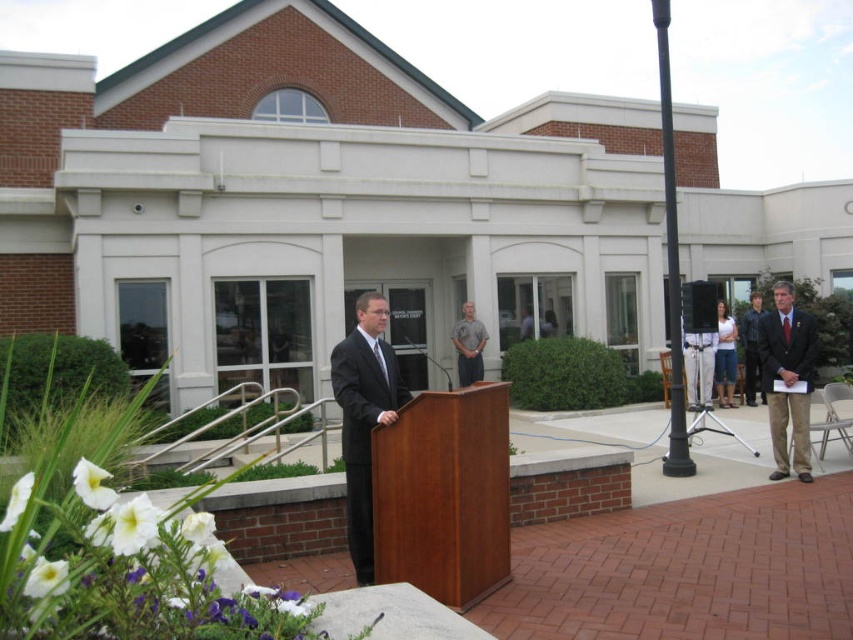
Question: Which of the following is the closest to the observer?

Choices:
 (A) dark blue leather jacket at right
 (B) dark brown suit at right

Answer: (B)

Question: Can you confirm if cherry wood podium at center is smaller than white cotton shirt at center?

Choices:
 (A) yes
 (B) no

Answer: (A)

Question: Which object is positioned closest to the dark blue leather jacket at right?

Choices:
 (A) white cotton shirt at center
 (B) dark brown suit at right
 (C) dark gray suit at center

Answer: (A)

Question: Among these points, which one is farthest from the camera?

Choices:
 (A) (747, 317)
 (B) (788, 317)
 (C) (468, 364)
 (D) (474, 413)

Answer: (A)

Question: Observing the image, what is the correct spatial positioning of cherry wood podium at center in reference to white cotton shirt at center?

Choices:
 (A) above
 (B) below

Answer: (B)

Question: Observing the image, what is the correct spatial positioning of cherry wood podium at center in reference to gray cotton shirt at center?

Choices:
 (A) below
 (B) above

Answer: (A)